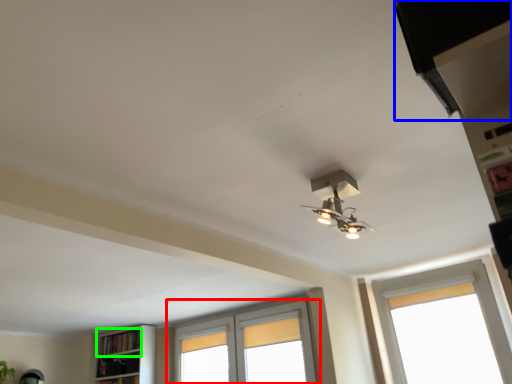
Question: Estimate the real-world distances between objects in this image. Which object is closer to window (highlighted by a red box), exhaust hood (highlighted by a blue box) or shelf (highlighted by a green box)?

Choices:
 (A) exhaust hood
 (B) shelf

Answer: (B)